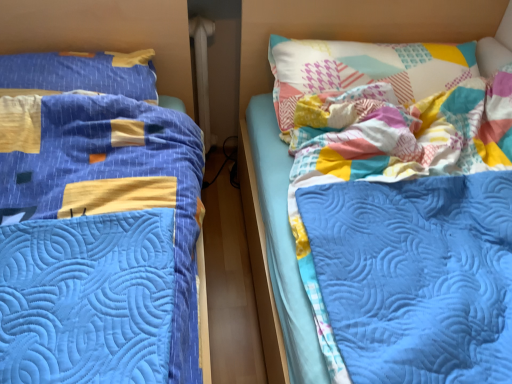
Question: Is patchwork fabric pillow at upper right, acting as the second pillow starting from the left, facing away from blue quilted pillow at left, the 2th pillow when ordered from right to left?

Choices:
 (A) yes
 (B) no

Answer: (B)

Question: Is patchwork fabric pillow at upper right, acting as the second pillow starting from the left, positioned before blue quilted pillow at left, placed as the first pillow when sorted from left to right?

Choices:
 (A) no
 (B) yes

Answer: (B)

Question: Does patchwork fabric pillow at upper right, acting as the second pillow starting from the left, appear on the right side of blue quilted pillow at left, placed as the first pillow when sorted from left to right?

Choices:
 (A) yes
 (B) no

Answer: (A)

Question: From a real-world perspective, is patchwork fabric pillow at upper right, acting as the second pillow starting from the left, on blue quilted pillow at left, placed as the first pillow when sorted from left to right?

Choices:
 (A) no
 (B) yes

Answer: (A)

Question: Considering the relative positions of patchwork fabric pillow at upper right, acting as the second pillow starting from the left, and blue quilted pillow at left, placed as the first pillow when sorted from left to right, in the image provided, is patchwork fabric pillow at upper right, acting as the second pillow starting from the left, to the left of blue quilted pillow at left, placed as the first pillow when sorted from left to right, from the viewer's perspective?

Choices:
 (A) yes
 (B) no

Answer: (B)

Question: Looking at their shapes, would you say blue quilted pillow at left, the 2th pillow when ordered from right to left, is wider or thinner than patchwork fabric pillow at upper right, acting as the second pillow starting from the left?

Choices:
 (A) thin
 (B) wide

Answer: (A)

Question: From the image's perspective, is blue quilted pillow at left, placed as the first pillow when sorted from left to right, above or below patchwork fabric pillow at upper right, which is the 1th pillow in right-to-left order?

Choices:
 (A) below
 (B) above

Answer: (B)

Question: Looking at the image, does blue quilted pillow at left, placed as the first pillow when sorted from left to right, seem bigger or smaller compared to patchwork fabric pillow at upper right, acting as the second pillow starting from the left?

Choices:
 (A) small
 (B) big

Answer: (A)

Question: From a real-world perspective, relative to patchwork fabric pillow at upper right, which is the 1th pillow in right-to-left order, is blue quilted pillow at left, placed as the first pillow when sorted from left to right, vertically above or below?

Choices:
 (A) below
 (B) above

Answer: (B)

Question: In the image, is patchwork fabric pillow at upper right, which is the 1th pillow in right-to-left order, positioned in front of or behind blue quilted pillow at left, placed as the first pillow when sorted from left to right?

Choices:
 (A) behind
 (B) front

Answer: (B)

Question: Is patchwork fabric pillow at upper right, which is the 1th pillow in right-to-left order, taller or shorter than blue quilted pillow at left, the 2th pillow when ordered from right to left?

Choices:
 (A) tall
 (B) short

Answer: (A)

Question: From a real-world perspective, is patchwork fabric pillow at upper right, which is the 1th pillow in right-to-left order, physically located above or below blue quilted pillow at left, placed as the first pillow when sorted from left to right?

Choices:
 (A) above
 (B) below

Answer: (B)

Question: From the image's perspective, is patchwork fabric pillow at upper right, which is the 1th pillow in right-to-left order, located above or below blue quilted pillow at left, placed as the first pillow when sorted from left to right?

Choices:
 (A) above
 (B) below

Answer: (B)

Question: From the image's perspective, is patchwork fabric pillow at upper right, acting as the second pillow starting from the left, positioned above or below blue quilted bed at left?

Choices:
 (A) below
 (B) above

Answer: (B)

Question: From a real-world perspective, relative to blue quilted bed at left, is patchwork fabric pillow at upper right, acting as the second pillow starting from the left, vertically above or below?

Choices:
 (A) below
 (B) above

Answer: (B)